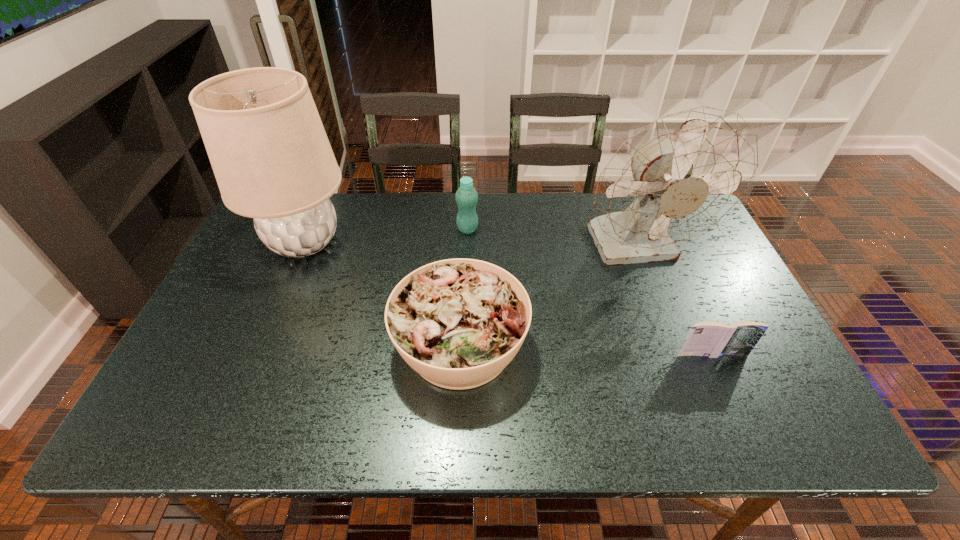
The image size is (960, 540). Identify the location of free space between the leftmost object and the fan. (470, 245).

Locate an element on the screen. This screenshot has height=540, width=960. object that is the fourth closest to the lampshade is located at coordinates (709, 339).

Choose which object is the nearest neighbor to the book. Please provide its 2D coordinates. Your answer should be formatted as a tuple, i.e. [(x, y)], where the tuple contains the x and y coordinates of a point satisfying the conditions above.

[(683, 175)]